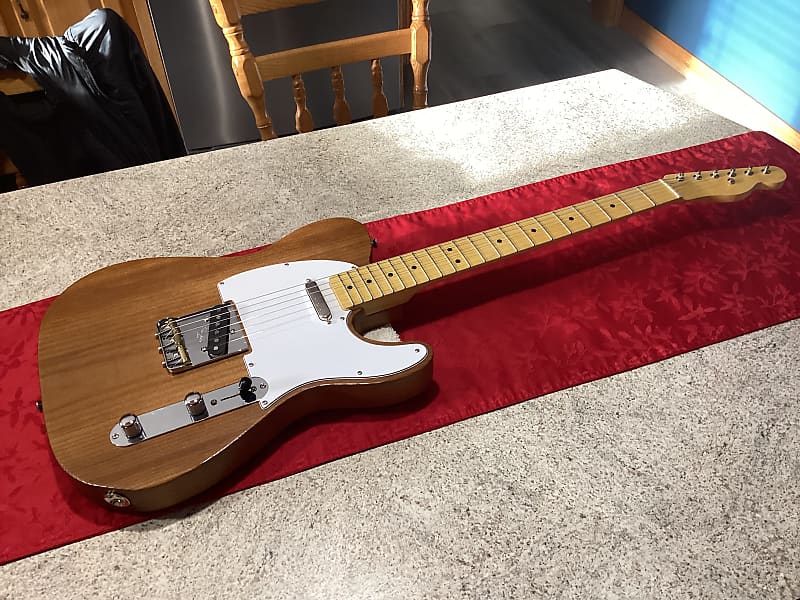
I want to click on chair, so click(298, 53).